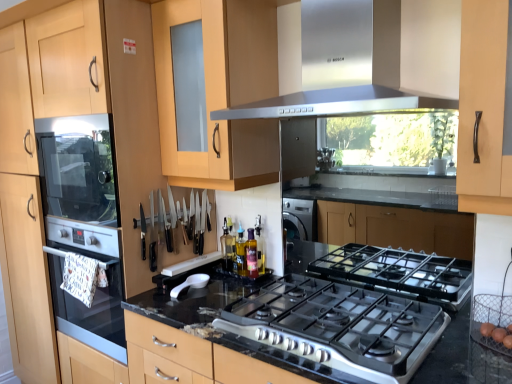
Identify the location of free space in front of translucent glass bottle at center, placed as the 2th bottle when sorted from right to left. The height and width of the screenshot is (384, 512). (x=236, y=285).